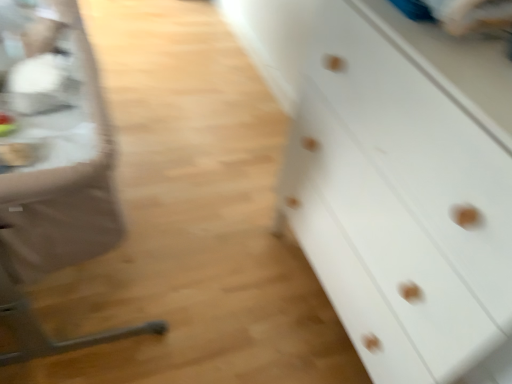
Question: From a real-world perspective, is white matte chest of drawers at right on top of metallic silver feeding chair at left?

Choices:
 (A) yes
 (B) no

Answer: (A)

Question: Is metallic silver feeding chair at left inside white matte chest of drawers at right?

Choices:
 (A) no
 (B) yes

Answer: (A)

Question: Is white matte chest of drawers at right aimed at metallic silver feeding chair at left?

Choices:
 (A) yes
 (B) no

Answer: (A)

Question: Can you confirm if white matte chest of drawers at right is taller than metallic silver feeding chair at left?

Choices:
 (A) no
 (B) yes

Answer: (B)

Question: Is white matte chest of drawers at right at the right side of metallic silver feeding chair at left?

Choices:
 (A) no
 (B) yes

Answer: (B)

Question: Considering the relative sizes of white matte chest of drawers at right and metallic silver feeding chair at left in the image provided, is white matte chest of drawers at right bigger than metallic silver feeding chair at left?

Choices:
 (A) yes
 (B) no

Answer: (B)

Question: Can you confirm if metallic silver table at left is shorter than white matte chest of drawers at right?

Choices:
 (A) yes
 (B) no

Answer: (A)

Question: Is metallic silver table at left not close to white matte chest of drawers at right?

Choices:
 (A) no
 (B) yes

Answer: (A)

Question: Does metallic silver table at left appear on the right side of white matte chest of drawers at right?

Choices:
 (A) yes
 (B) no

Answer: (B)

Question: Is metallic silver table at left further to camera compared to white matte chest of drawers at right?

Choices:
 (A) no
 (B) yes

Answer: (B)

Question: Can you confirm if metallic silver table at left is wider than white matte chest of drawers at right?

Choices:
 (A) no
 (B) yes

Answer: (A)

Question: Is metallic silver table at left facing away from white matte chest of drawers at right?

Choices:
 (A) yes
 (B) no

Answer: (B)

Question: Can you confirm if metallic silver table at left is thinner than metallic silver feeding chair at left?

Choices:
 (A) yes
 (B) no

Answer: (A)